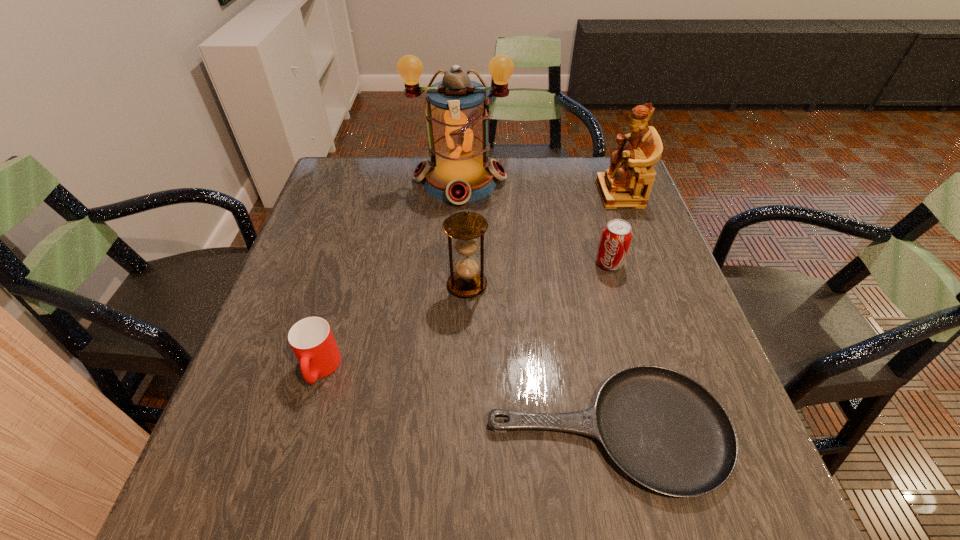
Locate an element on the screen. This screenshot has width=960, height=540. free space located on the front-facing side of the second tallest object is located at coordinates (561, 194).

You are a GUI agent. You are given a task and a screenshot of the screen. Output one action in this format:
    pyautogui.click(x=<x>, y=<y>)
    Task: Click on the vacant space located 0.360m on the front of the fourth shortest object
    The height and width of the screenshot is (540, 960).
    Given the screenshot: What is the action you would take?
    pyautogui.click(x=463, y=463)

You are a GUI agent. You are given a task and a screenshot of the screen. Output one action in this format:
    pyautogui.click(x=<x>, y=<y>)
    Task: Click on the free location located on the back of the fourth tallest object
    Image resolution: width=960 pixels, height=540 pixels.
    Given the screenshot: What is the action you would take?
    pyautogui.click(x=596, y=218)

I want to click on vacant space located on the side of the leftmost object with the handle, so click(294, 457).

At what (x,y) coordinates should I click in order to perform the action: click on vacant space located 0.060m on the left of the frying pan. Please return your answer as a coordinate pair (x, y). Image resolution: width=960 pixels, height=540 pixels. Looking at the image, I should click on (454, 430).

Locate an element on the screen. The width and height of the screenshot is (960, 540). lantern that is at the far edge is located at coordinates (457, 113).

Find the location of a particular element. figurine that is at the far edge is located at coordinates 627,183.

Find the location of a particular element. This screenshot has width=960, height=540. object that is at the near edge is located at coordinates (665, 430).

Locate an element on the screen. The width and height of the screenshot is (960, 540). object present at the left edge is located at coordinates (311, 339).

In order to click on figurine at the right edge in this screenshot , I will do `click(627, 183)`.